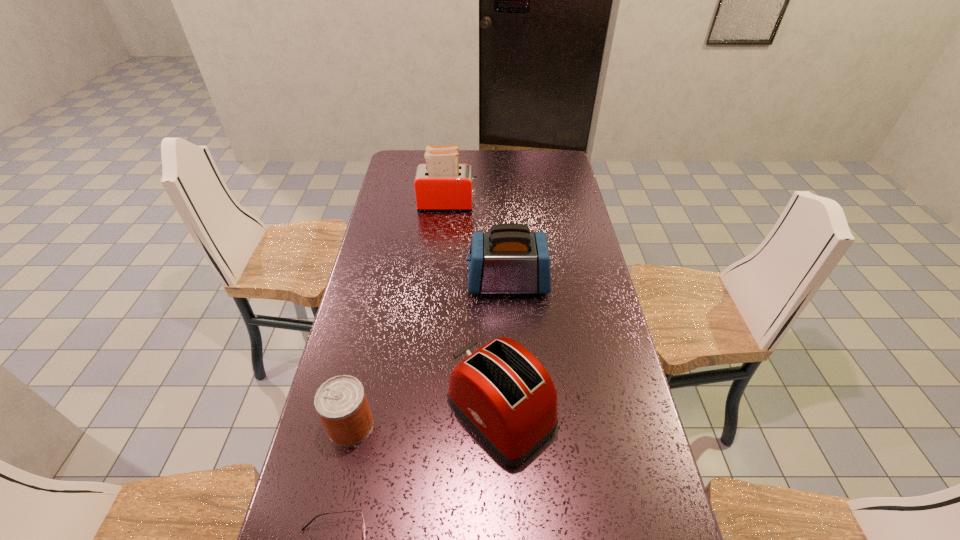
At what (x,y) coordinates should I click in order to perform the action: click on the farthest toaster. Please return your answer as a coordinate pair (x, y). The height and width of the screenshot is (540, 960). Looking at the image, I should click on (442, 184).

In order to click on the fourth nearest object in this screenshot , I will do `click(509, 259)`.

The image size is (960, 540). I want to click on the nearest toaster, so (506, 396).

This screenshot has height=540, width=960. In order to click on can in this screenshot , I will do `click(341, 402)`.

The image size is (960, 540). I want to click on free space located 0.080m on the front-facing side of the farthest toaster, so click(496, 204).

Find the location of a particular element. free space located 0.250m on the front-facing side of the second farthest object is located at coordinates (395, 282).

The width and height of the screenshot is (960, 540). Identify the location of free region located 0.340m on the front-facing side of the second farthest object. (368, 282).

This screenshot has width=960, height=540. Find the location of `vacant space located 0.050m on the front-facing side of the second farthest object`. vacant space located 0.050m on the front-facing side of the second farthest object is located at coordinates (453, 282).

Locate an element on the screen. The height and width of the screenshot is (540, 960). vacant area situated 0.240m on the back of the nearest toaster is located at coordinates (497, 304).

In order to click on free point located on the back of the fourth tallest object in this screenshot , I will do `click(379, 299)`.